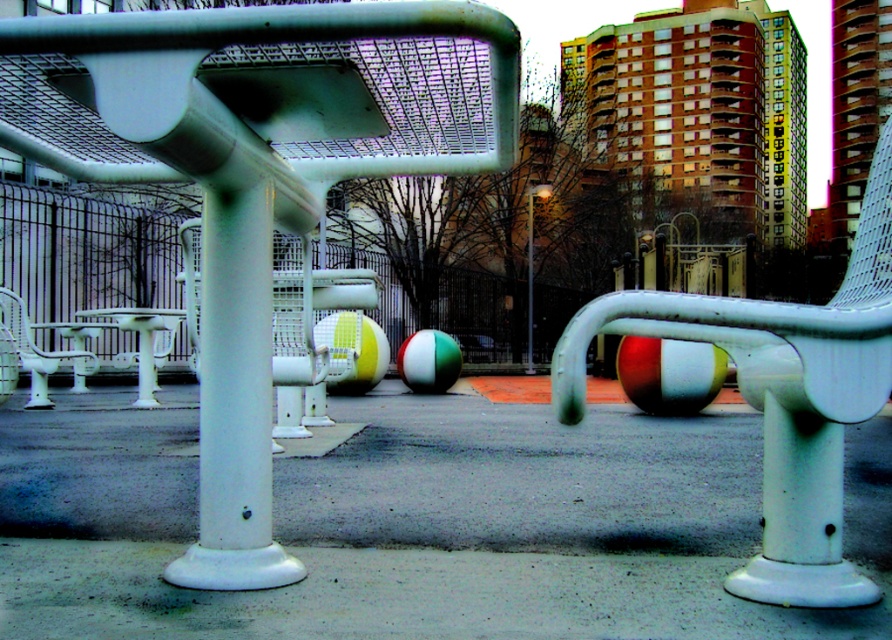
Question: Among these points, which one is farthest from the camera?

Choices:
 (A) (556, 364)
 (B) (176, 316)

Answer: (B)

Question: Which point is farther to the camera?

Choices:
 (A) white plastic chair at center
 (B) white glossy pole at center
 (C) white plastic stool at left
 (D) white plastic chair at left

Answer: (B)

Question: Estimate the real-world distances between objects in this image. Which object is closer to the white plastic chair at center?

Choices:
 (A) white plastic chair at left
 (B) white plastic stool at left
 (C) green and white rubber ball at center
 (D) white glossy pole at center

Answer: (A)

Question: Does white glossy beach ball at center have a greater width compared to green and white rubber ball at center?

Choices:
 (A) no
 (B) yes

Answer: (B)

Question: Can you confirm if yellow-green striped beach ball at center is positioned to the right of white plastic chair at left?

Choices:
 (A) no
 (B) yes

Answer: (B)

Question: Does yellow-green striped beach ball at center lie in front of white glossy pole at center?

Choices:
 (A) no
 (B) yes

Answer: (B)